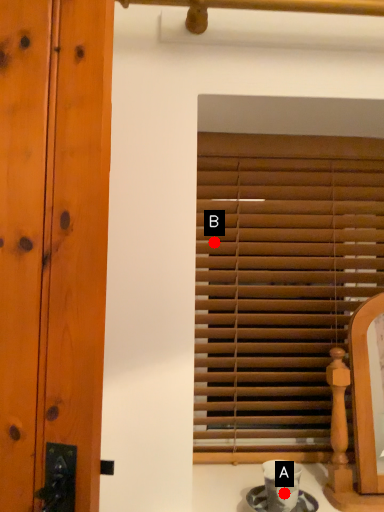
Question: Two points are circled on the image, labeled by A and B beside each circle. Which point is closer to the camera?

Choices:
 (A) A is closer
 (B) B is closer

Answer: (A)